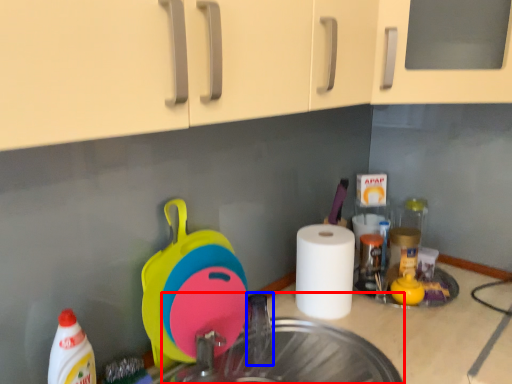
Question: Which of the following is the closest to the observer, sink (highlighted by a red box) or faucet (highlighted by a blue box)?

Choices:
 (A) sink
 (B) faucet

Answer: (A)